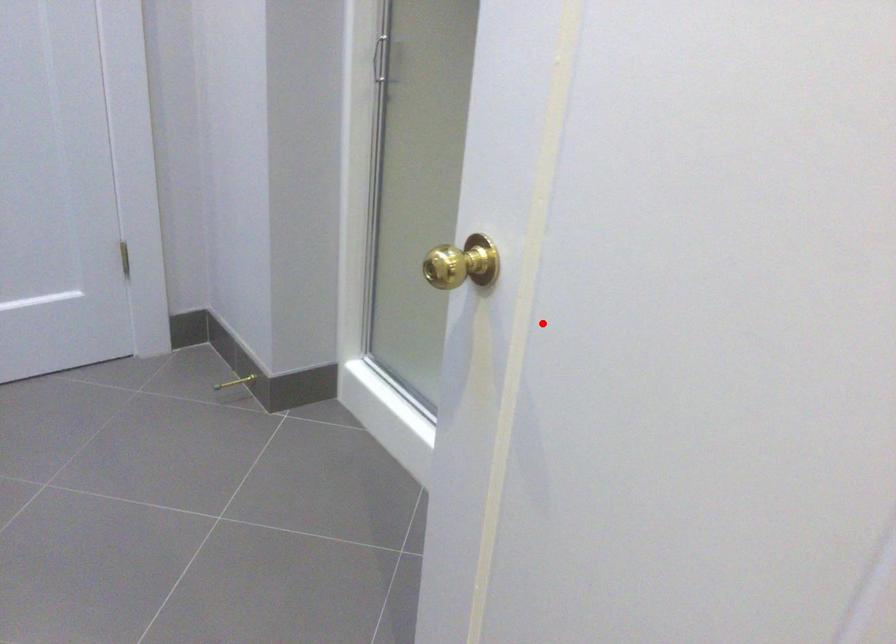
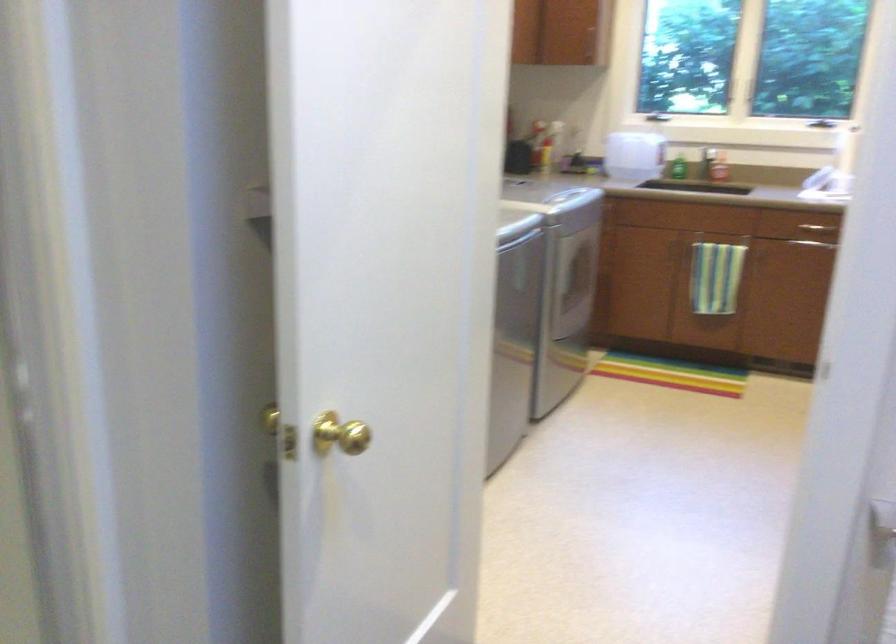
In the second image, find the point that corresponds to the highlighted location in the first image.

(339, 433)